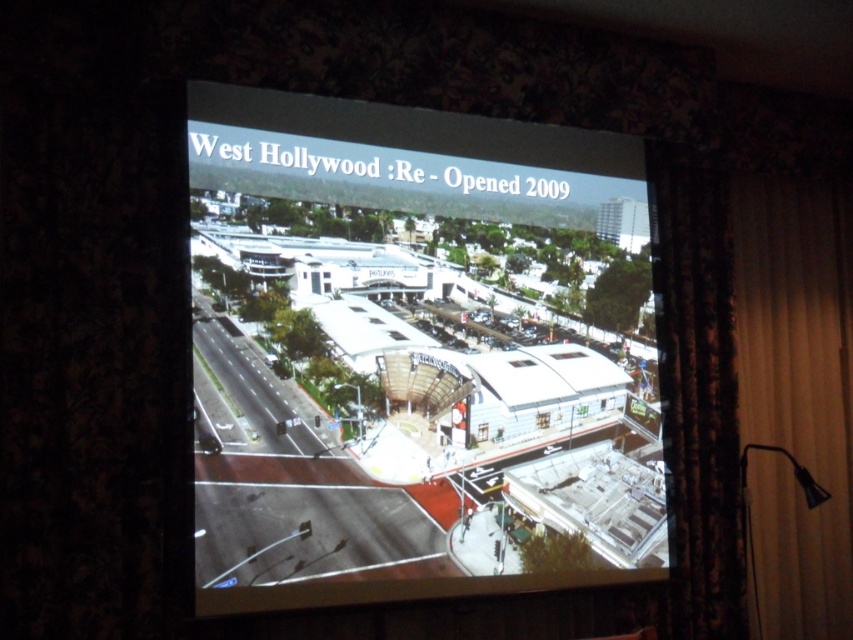
You are a stagehand adjusting curtains for a presentation. You need to ensure there is enough space between the beige fabric curtain at right and the black floral curtain at right to allow a 16 inch wide projector to fit between them. Can the projector fit between them?

The distance between the beige fabric curtain at right and the black floral curtain at right is 15.79 inches. Since the projector requires 16 inches, it cannot fit as the available space is slightly less than required.

You are standing in a room where a slide about West Hollywood is being projected. The slide shows a white glossy building at center. If you want to estimate how far the building is from your current position, what is the approximate distance?

The white glossy building at center is approximately 10.51 feet away from the camera, so the distance from your current position to the building would be around 10.51 feet.

You are sitting in a meeting room and looking at the projected slide of West Hollywood. There are two points marked on the slide. The first point is at coordinate point (537, 502) and the second point is at coordinate point (677, 202). From your perspective, which point is closer to you?

Point (537, 502) is in front of point (677, 202), so it is closer to you.